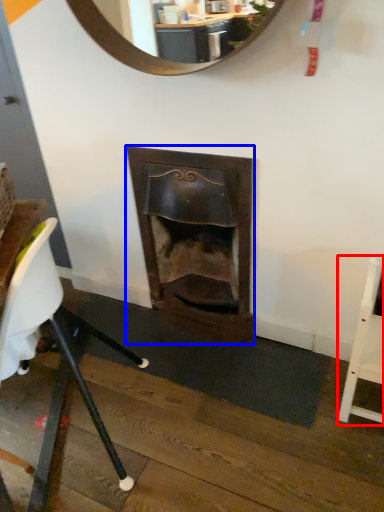
Question: Which object is closer to the camera taking this photo, chair (highlighted by a red box) or fireplace (highlighted by a blue box)?

Choices:
 (A) chair
 (B) fireplace

Answer: (A)